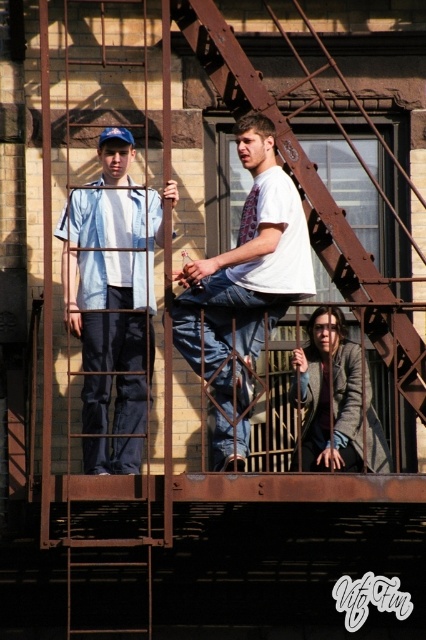
You are standing on the ground floor looking up at the fire escape. Which object, the denim shirt at left or the rusty metal fire escape at center, appears taller from your perspective?

The rusty metal fire escape at center appears taller than the denim shirt at left from your perspective because the denim shirt at left has a lesser height compared to the rusty metal fire escape at center.

You are standing on the fire escape and need to hand a tool to the person wearing the white cotton shirt at center. Given that you are positioned at point 0.5, 0.5 on the same coordinate system, can you reach them without moving?

The white cotton shirt at center is located at point (x=244, y=289), which is very close to your position at (x=213, y=320). Since the distance between these points is minimal, you can likely reach them without moving.

You are standing on the fire escape looking at the three people. There is a point marked at coordinates (244, 289). What object is located at that point?

The point at coordinates (244, 289) marks the white cotton shirt at center.